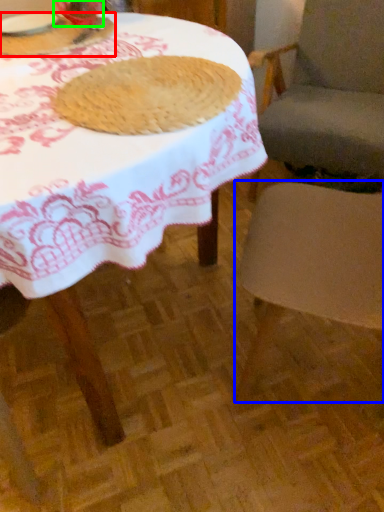
Question: Considering the real-world distances, which object is closest to breakfast (highlighted by a red box)? chair (highlighted by a blue box) or tableware (highlighted by a green box).

Choices:
 (A) chair
 (B) tableware

Answer: (B)